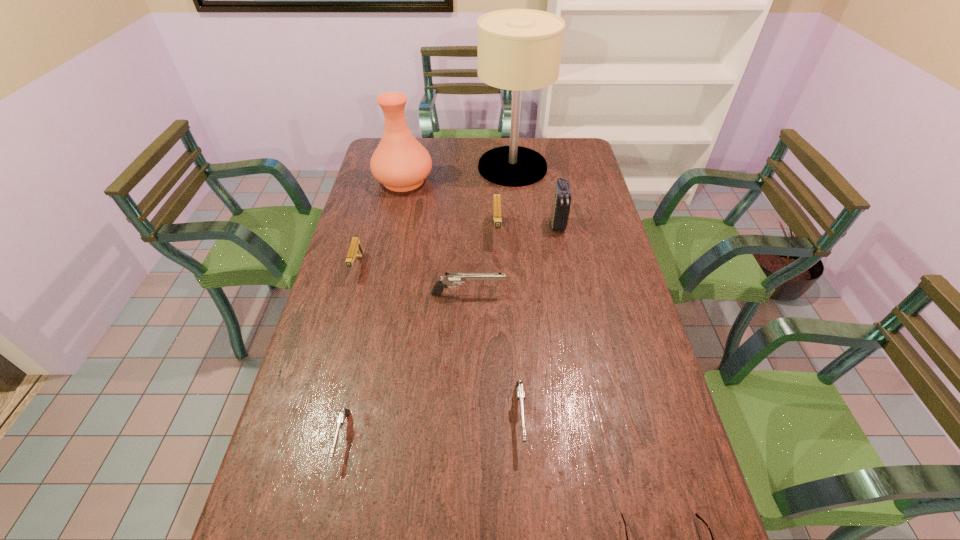
Select which silver pistol appears as the third closest to the eighth shortest object. Please provide its 2D coordinates. Your answer should be formatted as a tuple, i.e. [(x, y)], where the tuple contains the x and y coordinates of a point satisfying the conditions above.

[(344, 413)]

This screenshot has width=960, height=540. In order to click on silver pistol that is the third closest to the second tallest object in this screenshot , I will do `click(344, 413)`.